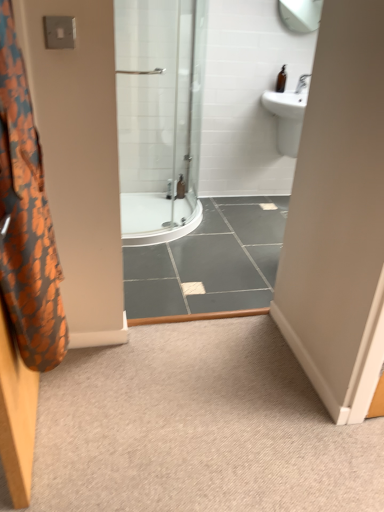
In order to face brown glass bottle at upper right, which appears as the second toiletry when ordered from the bottom, should I rotate leftwards or rightwards?

Turn right by 12.122 degrees to look at brown glass bottle at upper right, which appears as the second toiletry when ordered from the bottom.

The image size is (384, 512). I want to click on clear plastic bottle at center, positioned as the second toiletry in right-to-left order, so click(x=180, y=187).

At what (x,y) coordinates should I click in order to perform the action: click on white glossy sink at upper right. Please return your answer as a coordinate pair (x, y). Image resolution: width=384 pixels, height=512 pixels. Looking at the image, I should click on (288, 115).

Does white glossy sink at upper right appear on the left side of orange fabric shower curtain at left?

In fact, white glossy sink at upper right is to the right of orange fabric shower curtain at left.

From a real-world perspective, relative to orange fabric shower curtain at left, is white glossy sink at upper right vertically above or below?

white glossy sink at upper right is situated lower than orange fabric shower curtain at left in the real world.

Can you see white glossy sink at upper right touching orange fabric shower curtain at left?

No, white glossy sink at upper right is not touching orange fabric shower curtain at left.

In the scene shown: Considering the sizes of objects carpet at center and white glossy sink at upper right in the image provided, who is smaller, carpet at center or white glossy sink at upper right?

carpet at center.

The width and height of the screenshot is (384, 512). In order to click on plain below the white glossy sink at upper right (from a real-world perspective) in this screenshot , I will do 198,428.

From a real-world perspective, between carpet at center and white glossy sink at upper right, who is vertically lower?

From a 3D spatial view, carpet at center is below.

From the image's perspective, is carpet at center beneath white glossy sink at upper right?

Yes, from the image's perspective, carpet at center is below white glossy sink at upper right.

Can we say orange fabric shower curtain at left lies outside white glossy sink at upper right?

Indeed, orange fabric shower curtain at left is completely outside white glossy sink at upper right.

How many degrees apart are the facing directions of orange fabric shower curtain at left and white glossy sink at upper right?

92.7 degrees.

Locate an element on the screen. shower curtain in front of the white glossy sink at upper right is located at coordinates (26, 219).

From a real-world perspective, is orange fabric shower curtain at left below white glossy sink at upper right?

No, from a real-world perspective, orange fabric shower curtain at left is not beneath white glossy sink at upper right.

Is carpet at center taller than clear plastic bottle at center, positioned as the second toiletry in right-to-left order?

Incorrect, the height of carpet at center is not larger of that of clear plastic bottle at center, positioned as the second toiletry in right-to-left order.

From the image's perspective, is carpet at center above or below clear plastic bottle at center, which is the 2th toiletry in front-to-back order?

From the image's perspective, carpet at center appears below clear plastic bottle at center, which is the 2th toiletry in front-to-back order.

From a real-world perspective, relative to clear plastic bottle at center, which appears as the first toiletry when viewed from the left, is carpet at center vertically above or below?

carpet at center is below clear plastic bottle at center, which appears as the first toiletry when viewed from the left.

Can we say brown glass bottle at upper right, which is the first toiletry from right to left, lies outside orange fabric shower curtain at left?

Yes, brown glass bottle at upper right, which is the first toiletry from right to left, is outside of orange fabric shower curtain at left.

Consider the image. Between brown glass bottle at upper right, marked as the 1th toiletry in a front-to-back arrangement, and orange fabric shower curtain at left, which one has less height?

brown glass bottle at upper right, marked as the 1th toiletry in a front-to-back arrangement.

Which is closer to the camera, (285, 86) or (36, 286)?

Point (285, 86).

From the picture: Which object is further away from the camera taking this photo, brown glass bottle at upper right, marked as the 1th toiletry in a front-to-back arrangement, or orange fabric shower curtain at left?

brown glass bottle at upper right, marked as the 1th toiletry in a front-to-back arrangement, is behind.

From a real-world perspective, is orange fabric shower curtain at left physically located above or below carpet at center?

From a real-world perspective, orange fabric shower curtain at left is physically above carpet at center.

Does orange fabric shower curtain at left appear on the right side of carpet at center?

No, orange fabric shower curtain at left is not to the right of carpet at center.

Which point is more distant from viewer, (18, 239) or (225, 441)?

The point (225, 441) is farther from the camera.

From the image's perspective, between orange fabric shower curtain at left and carpet at center, who is located below?

carpet at center is shown below in the image.

Is orange fabric shower curtain at left in contact with brown glass bottle at upper right, which appears as the second toiletry when ordered from the bottom?

No, orange fabric shower curtain at left is not in contact with brown glass bottle at upper right, which appears as the second toiletry when ordered from the bottom.

From the image's perspective, is orange fabric shower curtain at left under brown glass bottle at upper right, which is the first toiletry from right to left?

Yes.

Considering the relative sizes of orange fabric shower curtain at left and brown glass bottle at upper right, marked as the second toiletry in a left-to-right arrangement, in the image provided, is orange fabric shower curtain at left thinner than brown glass bottle at upper right, marked as the second toiletry in a left-to-right arrangement,?

No.

Based on the photo, is orange fabric shower curtain at left inside or outside of brown glass bottle at upper right, which appears as the second toiletry when ordered from the bottom?

orange fabric shower curtain at left is located beyond the bounds of brown glass bottle at upper right, which appears as the second toiletry when ordered from the bottom.

Image resolution: width=384 pixels, height=512 pixels. In order to click on shower curtain below the white glossy sink at upper right (from the image's perspective) in this screenshot , I will do (x=26, y=219).

The image size is (384, 512). Find the location of `plain on the left of the white glossy sink at upper right`. plain on the left of the white glossy sink at upper right is located at coordinates tap(198, 428).

In the scene shown: Which object lies further to the anchor point carpet at center, orange fabric shower curtain at left or clear plastic bottle at center, which is the 1th toiletry in bottom-to-top order?

clear plastic bottle at center, which is the 1th toiletry in bottom-to-top order, is further to carpet at center.

Considering their positions, is brown glass bottle at upper right, which appears as the second toiletry when ordered from the bottom, positioned closer to carpet at center than clear plastic bottle at center, which is the 1th toiletry in bottom-to-top order?

clear plastic bottle at center, which is the 1th toiletry in bottom-to-top order, is positioned closer to the anchor carpet at center.

Estimate the real-world distances between objects in this image. Which object is further from white glossy sink at upper right, brown glass bottle at upper right, marked as the 1th toiletry in a front-to-back arrangement, or carpet at center?

carpet at center is further to white glossy sink at upper right.

In the scene shown: Considering their positions, is clear plastic bottle at center, which appears as the first toiletry when viewed from the left, positioned further to carpet at center than orange fabric shower curtain at left?

Among the two, clear plastic bottle at center, which appears as the first toiletry when viewed from the left, is located further to carpet at center.

When comparing their distances from orange fabric shower curtain at left, does brown glass bottle at upper right, which appears as the second toiletry when ordered from the bottom, or white glossy sink at upper right seem further?

brown glass bottle at upper right, which appears as the second toiletry when ordered from the bottom.

Looking at the image, which one is located further to white glossy sink at upper right, carpet at center or orange fabric shower curtain at left?

orange fabric shower curtain at left lies further to white glossy sink at upper right than the other object.

Looking at the image, which one is located closer to orange fabric shower curtain at left, brown glass bottle at upper right, marked as the second toiletry in a left-to-right arrangement, or carpet at center?

carpet at center lies closer to orange fabric shower curtain at left than the other object.

Which object lies further to the anchor point orange fabric shower curtain at left, carpet at center or brown glass bottle at upper right, which ranks as the second toiletry in back-to-front order?

Among the two, brown glass bottle at upper right, which ranks as the second toiletry in back-to-front order, is located further to orange fabric shower curtain at left.

Identify the location of sink between clear plastic bottle at center, the 1th toiletry positioned from the back, and brown glass bottle at upper right, marked as the 1th toiletry in a front-to-back arrangement. tap(288, 115).

You are a GUI agent. You are given a task and a screenshot of the screen. Output one action in this format:
    pyautogui.click(x=<x>, y=<y>)
    Task: Click on the toiletry between orange fabric shower curtain at left and clear plastic bottle at center, positioned as the second toiletry in right-to-left order, along the z-axis
    
    Given the screenshot: What is the action you would take?
    pyautogui.click(x=281, y=80)

The image size is (384, 512). Find the location of `sink located between orange fabric shower curtain at left and brown glass bottle at upper right, which appears as the second toiletry when ordered from the bottom, in the depth direction`. sink located between orange fabric shower curtain at left and brown glass bottle at upper right, which appears as the second toiletry when ordered from the bottom, in the depth direction is located at coordinates (288, 115).

The width and height of the screenshot is (384, 512). What are the coordinates of `sink between carpet at center and clear plastic bottle at center, which is the 1th toiletry in bottom-to-top order, in the front-back direction` in the screenshot? It's located at (288, 115).